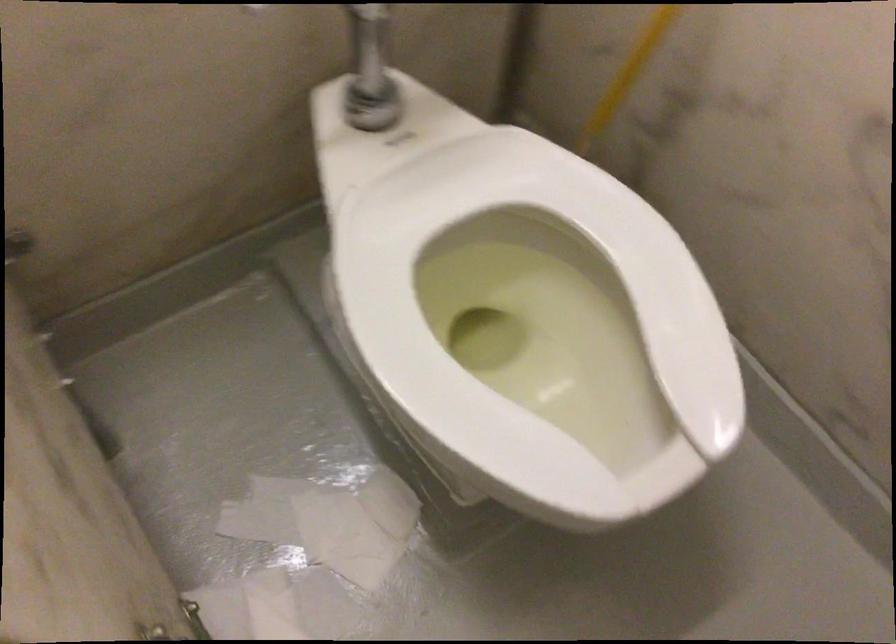
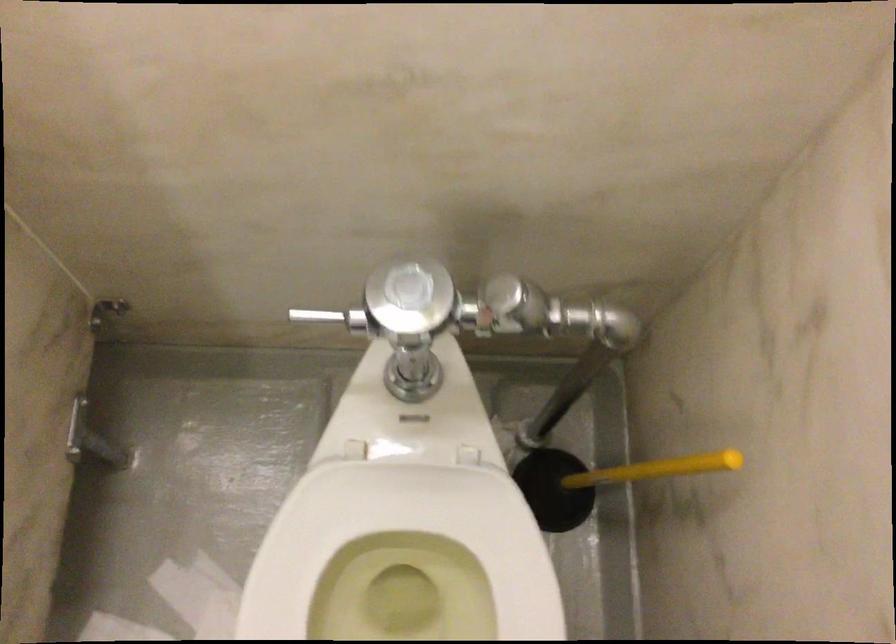
Question: Based on the continuous images, in which direction is the camera rotating? Reply with the corresponding letter.

Choices:
 (A) Left
 (B) Right
 (C) Up
 (D) Down

Answer: (A)